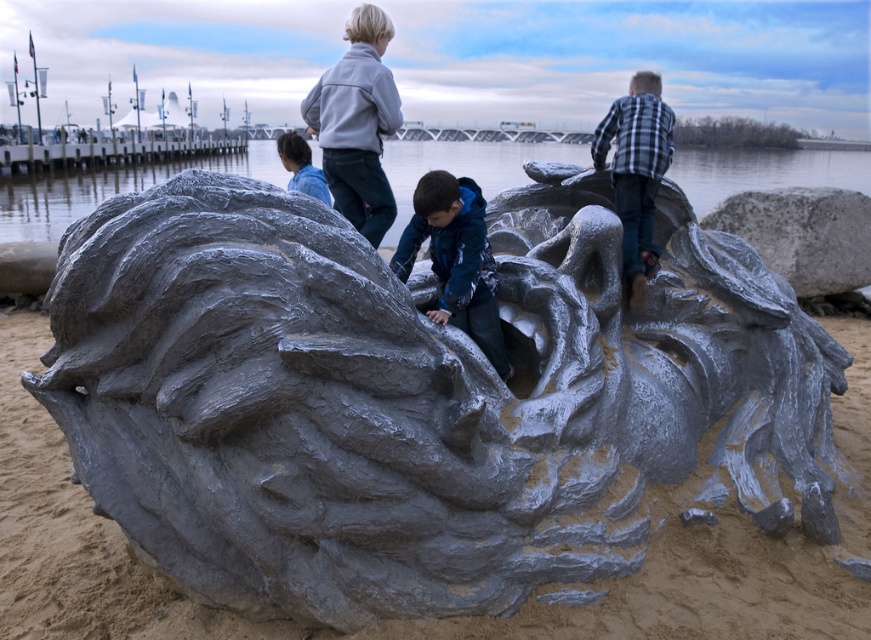
Question: Which point is farther from the camera taking this photo?

Choices:
 (A) (119, 163)
 (B) (442, 212)

Answer: (A)

Question: Which of the following is the farthest from the observer?

Choices:
 (A) checkered flannel shirt at upper right
 (B) gray matte sculpture at center
 (C) brushed metal dock at upper left

Answer: (C)

Question: Which is nearer to the clear water at center?

Choices:
 (A) gray matte rock at upper right
 (B) matte gray sculpture at center

Answer: (B)

Question: Is clear water at center further to the viewer compared to matte gray sculpture at center?

Choices:
 (A) no
 (B) yes

Answer: (B)

Question: From the image, what is the correct spatial relationship of gray matte sculpture at center in relation to blue denim jacket at lower left?

Choices:
 (A) left
 (B) right

Answer: (B)

Question: Does checkered flannel shirt at upper right appear over brushed metal dock at upper left?

Choices:
 (A) no
 (B) yes

Answer: (A)